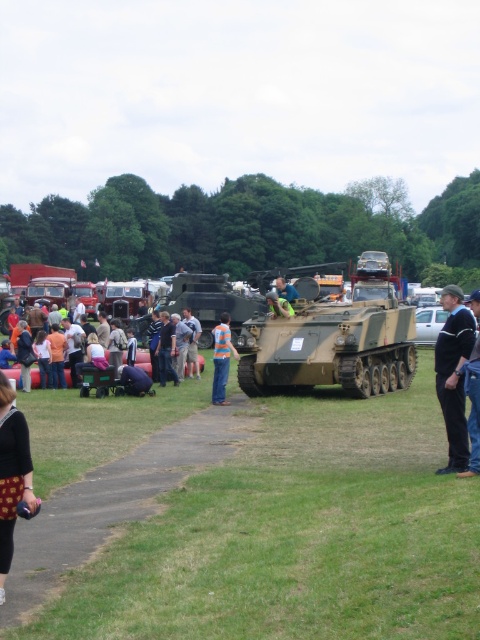
Question: Which of these objects is positioned closest to the orange striped shirt at center?

Choices:
 (A) denim jacket at lower left
 (B) black fabric jacket at center
 (C) black fabric pants at lower right

Answer: (A)

Question: Where is black fabric jacket at center located in relation to patterned fabric dress at lower left in the image?

Choices:
 (A) above
 (B) below

Answer: (A)

Question: Which point is closer to the camera?

Choices:
 (A) white matte car at center
 (B) black fabric jacket at center

Answer: (B)

Question: Can you confirm if camouflage matte tank at center is positioned above orange striped shirt at center?

Choices:
 (A) yes
 (B) no

Answer: (A)

Question: Is camouflage matte tank at center below blue fabric shirt at center?

Choices:
 (A) no
 (B) yes

Answer: (B)

Question: Which point is farther to the camera?

Choices:
 (A) (276, 276)
 (B) (172, 371)

Answer: (A)